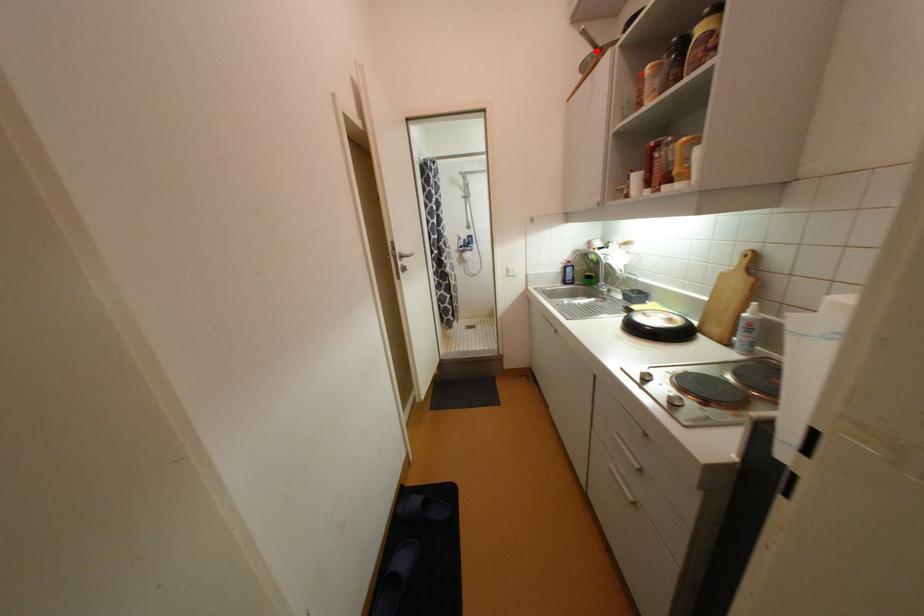
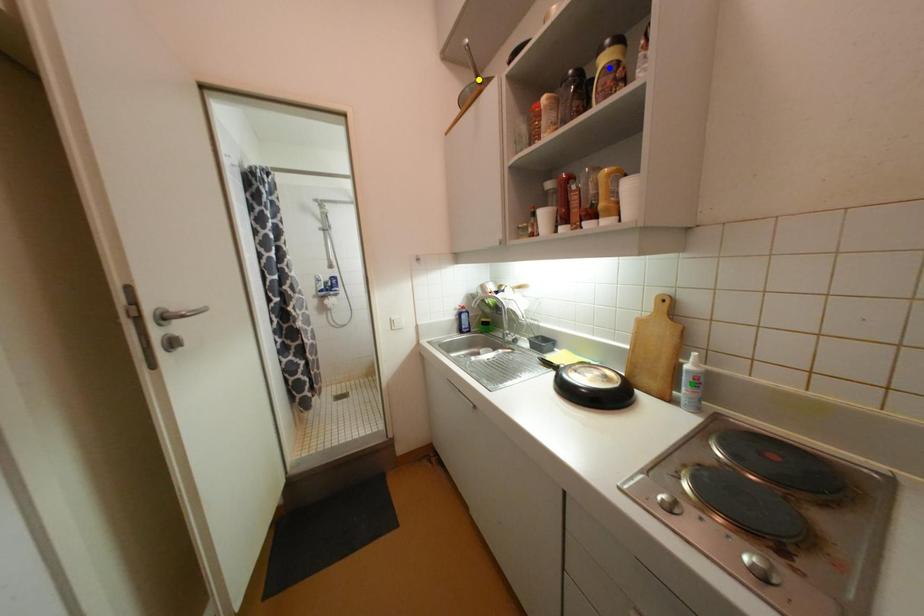
Question: I am providing you with two images of the same scene from different viewpoints. A red point is marked on the first image. You are given multiple points on the second image. Which point in image 2 is actually the same real-world point as the red point in image 1?

Choices:
 (A) blue point
 (B) yellow point
 (C) green point

Answer: (B)